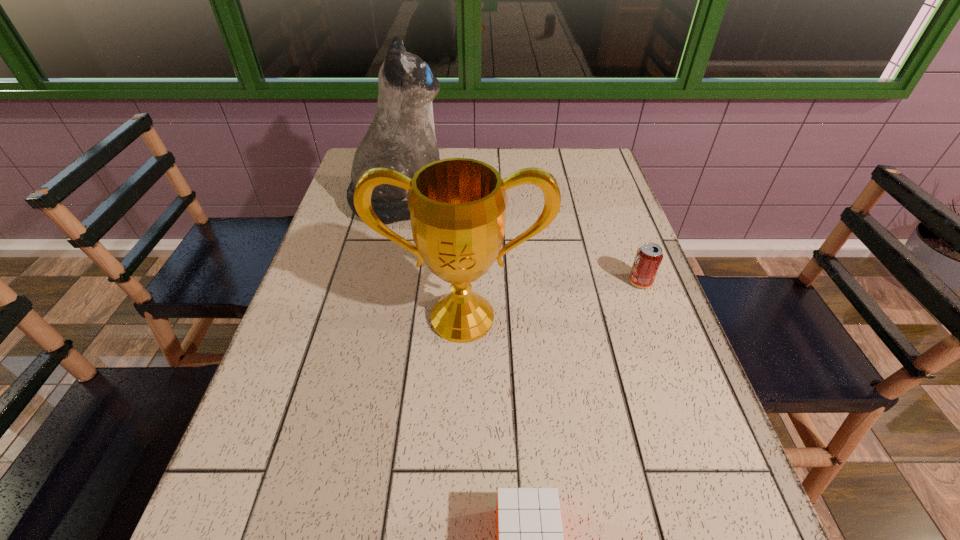
What are the coordinates of `object that is at the far left corner` in the screenshot? It's located at (401, 136).

Find the location of a particular element. This screenshot has width=960, height=540. vacant space at the far edge is located at coordinates [x=487, y=150].

Identify the location of vacant space at the left edge of the desktop. (294, 410).

You are a GUI agent. You are given a task and a screenshot of the screen. Output one action in this format:
    pyautogui.click(x=<x>, y=<y>)
    Task: Click on the free spot at the right edge of the desktop
    The image size is (960, 540).
    Given the screenshot: What is the action you would take?
    pyautogui.click(x=632, y=394)

In the image, there is a desktop. At what (x,y) coordinates should I click in order to perform the action: click on vacant space at the far right corner. Please return your answer as a coordinate pair (x, y). The image size is (960, 540). Looking at the image, I should click on (575, 164).

Locate an element on the screen. free space between the award and the rightmost object is located at coordinates (551, 300).

Image resolution: width=960 pixels, height=540 pixels. I want to click on empty location between the farthest object and the rightmost object, so click(x=527, y=242).

Identify the location of free space between the second tallest object and the soda can. (551, 300).

The height and width of the screenshot is (540, 960). In order to click on unoccupied area between the farthest object and the soda can in this screenshot , I will do `click(527, 242)`.

This screenshot has height=540, width=960. In order to click on object that is the second closest to the farthest object in this screenshot , I will do `click(649, 256)`.